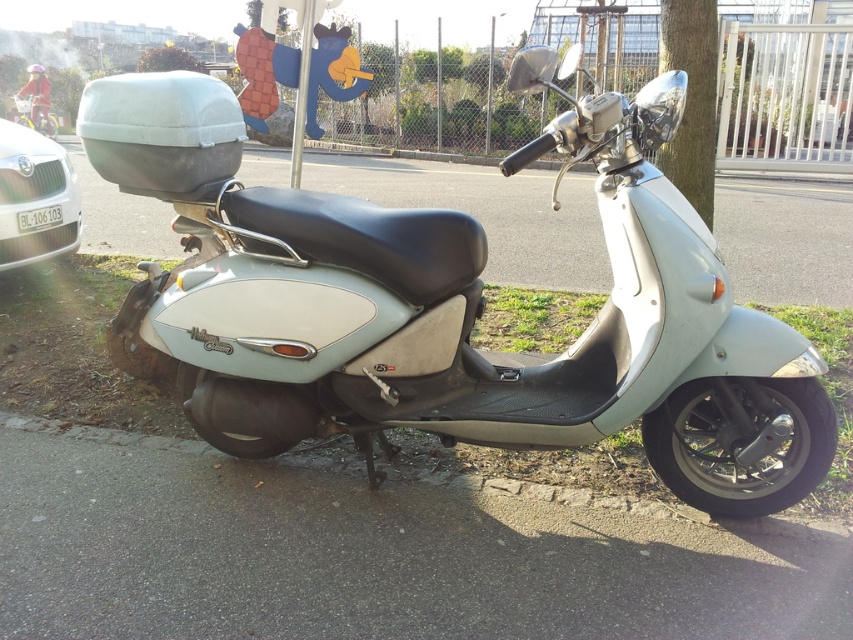
You are a delivery person who needs to park your vehicle between two poles that are 2 meters apart. You have a satin silver scooter at center and a matte white car at left. Which vehicle can fit through the space between the poles?

The satin silver scooter at center can fit through the space between the poles because its width surpasses the matte white car at left, meaning the scooter is narrower than the car. Since the space is 2 meters, the scooter, being narrower, would fit better than the car.

You are standing in front of the scooter and want to take a photo. There are two points marked on the scooter, one at coordinates point (32, 184) and another at point (39, 113). Which point will appear closer to the camera in your photo?

Point (32, 184) is closer to the camera than point (39, 113), so it will appear closer in the photo.

You are standing in front of the scooter and want to take a photo. You notice two points on the scooter, one at point (16, 260) and another at point (39, 212). Which point will appear larger in your photo?

Point (16, 260) is closer to the camera than point (39, 212), so it will appear larger in the photo.